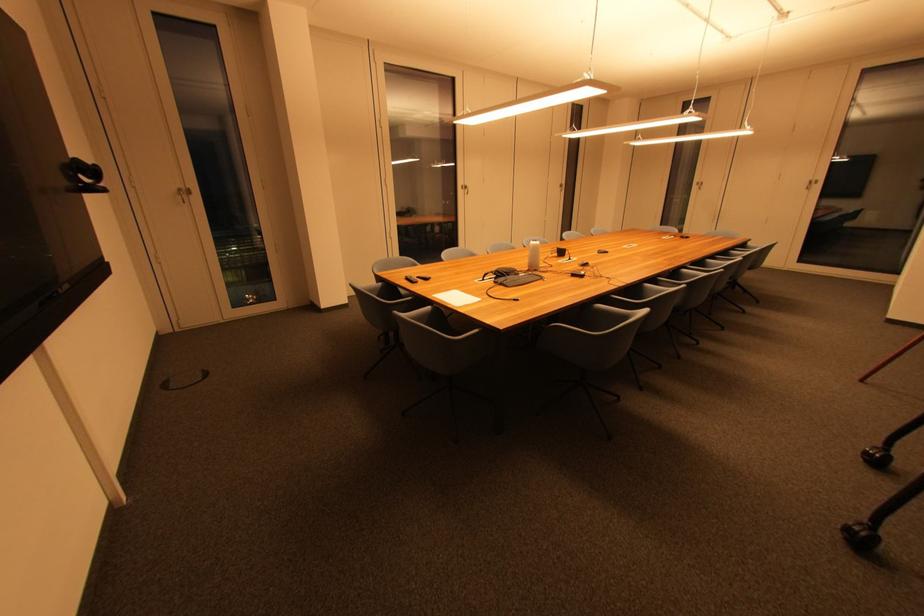
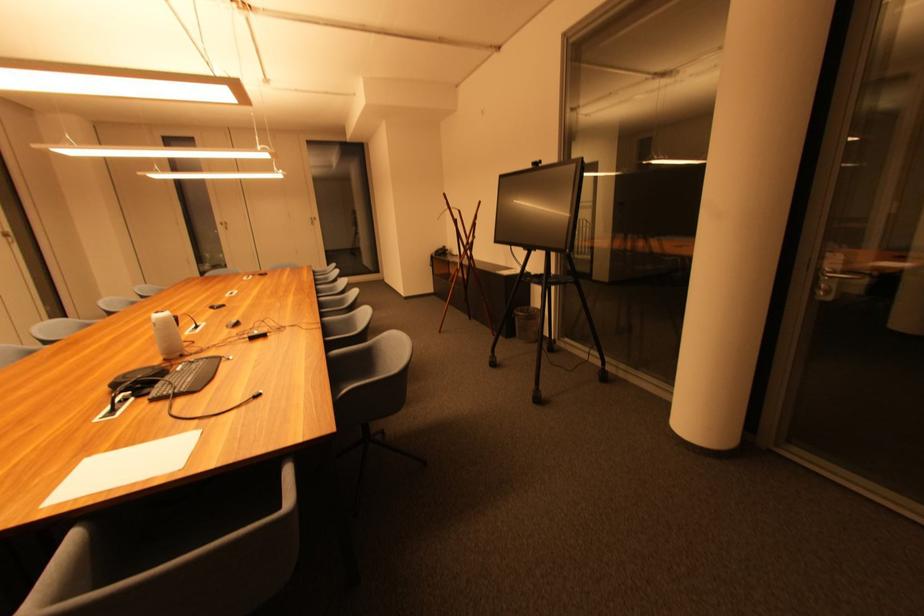
The point at (526, 277) is marked in the first image. Where is the corresponding point in the second image?

(184, 371)